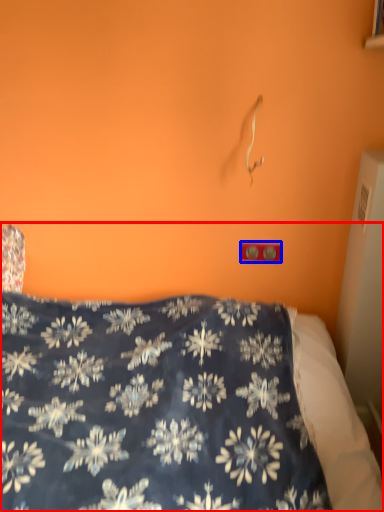
Question: Which object is further to the camera taking this photo, bed (highlighted by a red box) or electric outlet (highlighted by a blue box)?

Choices:
 (A) bed
 (B) electric outlet

Answer: (B)